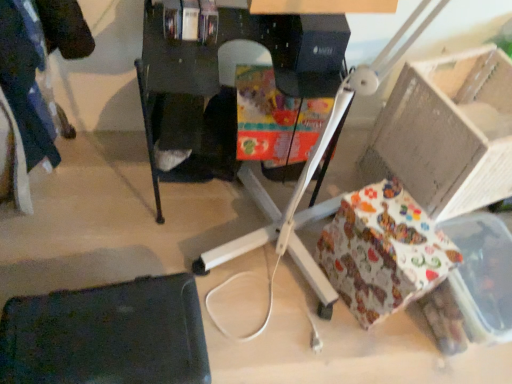
Measure the distance between black matte swivel chair at lower left and camera.

black matte swivel chair at lower left is 95.50 centimeters from camera.

Image resolution: width=512 pixels, height=384 pixels. In order to click on patterned paper gift at lower right in this screenshot , I will do `click(383, 251)`.

Is black matte swivel chair at lower left oriented towards patterned paper gift at lower right?

No, black matte swivel chair at lower left is not facing towards patterned paper gift at lower right.

Considering the relative positions of black matte swivel chair at lower left and patterned paper gift at lower right in the image provided, is black matte swivel chair at lower left to the left of patterned paper gift at lower right from the viewer's perspective?

Correct, you'll find black matte swivel chair at lower left to the left of patterned paper gift at lower right.

Between black matte swivel chair at lower left and patterned paper gift at lower right, which one has larger width?

Wider between the two is patterned paper gift at lower right.

From the image's perspective, which one is positioned lower, black matte swivel chair at lower left or patterned paper gift at lower right?

black matte swivel chair at lower left appears lower in the image.

Image resolution: width=512 pixels, height=384 pixels. I want to click on furniture located above the black matte swivel chair at lower left (from a real-world perspective), so click(227, 86).

Does black matte swivel chair at lower left have a greater width compared to black plastic desk at center?

In fact, black matte swivel chair at lower left might be narrower than black plastic desk at center.

Is black matte swivel chair at lower left looking in the opposite direction of black plastic desk at center?

No, black plastic desk at center is not at the back of black matte swivel chair at lower left.

Is black matte swivel chair at lower left in front of black plastic desk at center?

Yes.

Is point (196, 165) positioned after point (114, 314)?

Yes.

Considering the sizes of objects black plastic desk at center and black matte swivel chair at lower left in the image provided, who is shorter, black plastic desk at center or black matte swivel chair at lower left?

black matte swivel chair at lower left.

From the picture: Does black plastic desk at center touch black matte swivel chair at lower left?

No, black plastic desk at center is not with black matte swivel chair at lower left.

In the image, is black plastic desk at center on the left side or the right side of white cardboard box at right?

Clearly, black plastic desk at center is on the left of white cardboard box at right in the image.

From a real-world perspective, which object stands above the other?

white cardboard box at right, from a real-world perspective.

Considering the relative sizes of black plastic desk at center and white cardboard box at right in the image provided, is black plastic desk at center wider than white cardboard box at right?

Yes, black plastic desk at center is wider than white cardboard box at right.

Can you tell me how much black plastic desk at center and white cardboard box at right differ in facing direction?

They differ by 18.8 degrees in their facing directions.

From a real-world perspective, is patterned paper gift at lower right located higher than black plastic desk at center?

No, from a real-world perspective, patterned paper gift at lower right is not on top of black plastic desk at center.

Can you tell me how much patterned paper gift at lower right and black plastic desk at center differ in facing direction?

patterned paper gift at lower right and black plastic desk at center are facing 22.4 degrees away from each other.

How much distance is there between patterned paper gift at lower right and black plastic desk at center?

The distance of patterned paper gift at lower right from black plastic desk at center is 19.29 inches.

Considering the sizes of objects patterned paper gift at lower right and black plastic desk at center in the image provided, who is thinner, patterned paper gift at lower right or black plastic desk at center?

Thinner between the two is patterned paper gift at lower right.

From a real-world perspective, is white cardboard box at right on top of black plastic desk at center?

Correct, in the physical world, white cardboard box at right is higher than black plastic desk at center.

Does point (409, 156) appear closer or farther from the camera than point (310, 45)?

Point (409, 156) is farther from the camera than point (310, 45).

Which of these two, white cardboard box at right or black plastic desk at center, is thinner?

Thinner between the two is white cardboard box at right.

From the image's perspective, between white cardboard box at right and black plastic desk at center, which one is located above?

black plastic desk at center is shown above in the image.

From the image's perspective, which one is positioned higher, patterned paper gift at lower right or black matte swivel chair at lower left?

patterned paper gift at lower right appears higher in the image.

Would you say patterned paper gift at lower right is outside black matte swivel chair at lower left?

patterned paper gift at lower right lies outside black matte swivel chair at lower left's area.

Considering the relative sizes of patterned paper gift at lower right and black matte swivel chair at lower left in the image provided, is patterned paper gift at lower right shorter than black matte swivel chair at lower left?

In fact, patterned paper gift at lower right may be taller than black matte swivel chair at lower left.

Where is `swivel chair on the left side of patterned paper gift at lower right`? The width and height of the screenshot is (512, 384). swivel chair on the left side of patterned paper gift at lower right is located at coordinates (106, 335).

At what (x,y) coordinates should I click in order to perform the action: click on furniture that is behind the black matte swivel chair at lower left. Please return your answer as a coordinate pair (x, y). The width and height of the screenshot is (512, 384). Looking at the image, I should click on (x=227, y=86).

Which object lies nearer to the anchor point black plastic desk at center, white cardboard box at right or black matte swivel chair at lower left?

white cardboard box at right is closer to black plastic desk at center.

From the image, which object appears to be farther from patterned paper gift at lower right, black plastic desk at center or black matte swivel chair at lower left?

Among the two, black matte swivel chair at lower left is located further to patterned paper gift at lower right.

Which object lies further to the anchor point black plastic desk at center, white cardboard box at right or patterned paper gift at lower right?

patterned paper gift at lower right is further to black plastic desk at center.

In the scene shown: Estimate the real-world distances between objects in this image. Which object is further from black plastic desk at center, black matte swivel chair at lower left or patterned paper gift at lower right?

black matte swivel chair at lower left is positioned further to the anchor black plastic desk at center.

From the image, which object appears to be nearer to black matte swivel chair at lower left, patterned paper gift at lower right or black plastic desk at center?

black plastic desk at center is positioned closer to the anchor black matte swivel chair at lower left.

When comparing their distances from patterned paper gift at lower right, does white cardboard box at right or black matte swivel chair at lower left seem further?

Based on the image, black matte swivel chair at lower left appears to be further to patterned paper gift at lower right.

Which object lies further to the anchor point patterned paper gift at lower right, white cardboard box at right or black plastic desk at center?

black plastic desk at center is further to patterned paper gift at lower right.

Which object lies further to the anchor point black plastic desk at center, patterned paper gift at lower right or white cardboard box at right?

patterned paper gift at lower right.

Find the location of a particular element. wrapping paper located between black matte swivel chair at lower left and white cardboard box at right in the left-right direction is located at coordinates (383, 251).

Identify the location of wrapping paper between black plastic desk at center and white cardboard box at right from left to right. The width and height of the screenshot is (512, 384). (383, 251).

The width and height of the screenshot is (512, 384). I want to click on furniture between black matte swivel chair at lower left and white cardboard box at right in the horizontal direction, so click(x=227, y=86).

Locate an element on the screen. This screenshot has width=512, height=384. furniture between black matte swivel chair at lower left and patterned paper gift at lower right is located at coordinates (227, 86).